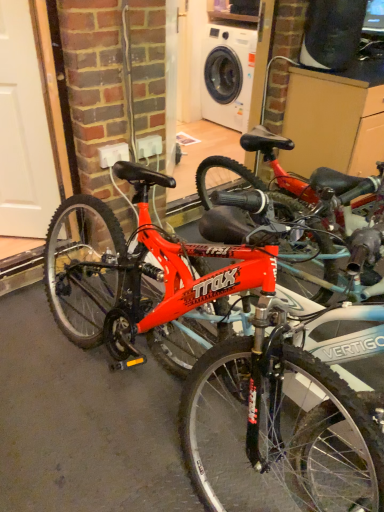
Identify the location of white glossy garage door at left. (24, 130).

From the picture: What is the approximate width of white glossy garage door at left?

2.89 inches.

The image size is (384, 512). Describe the element at coordinates (24, 130) in the screenshot. I see `white glossy garage door at left` at that location.

Locate an element on the screen. This screenshot has width=384, height=512. shiny red bicycle at center is located at coordinates (239, 336).

What do you see at coordinates (239, 336) in the screenshot?
I see `shiny red bicycle at center` at bounding box center [239, 336].

The image size is (384, 512). What are the coordinates of `white glossy garage door at left` in the screenshot? It's located at (24, 130).

Considering the positions of objects white glossy garage door at left and shiny red bicycle at center in the image provided, who is more to the left, white glossy garage door at left or shiny red bicycle at center?

white glossy garage door at left.

Considering their positions, is white glossy garage door at left located in front of or behind shiny red bicycle at center?

white glossy garage door at left is positioned farther from the viewer than shiny red bicycle at center.

Is point (25, 206) less distant than point (335, 184)?

That is False.

From the image's perspective, which object appears higher, white glossy garage door at left or shiny red bicycle at center?

From the image's view, white glossy garage door at left is above.

In the scene shown: From a real-world perspective, is white glossy garage door at left positioned above or below shiny red bicycle at center?

white glossy garage door at left is situated higher than shiny red bicycle at center in the real world.

Does white glossy garage door at left have a lesser width compared to shiny red bicycle at center?

Correct, the width of white glossy garage door at left is less than that of shiny red bicycle at center.

Considering the sizes of objects white glossy garage door at left and shiny red bicycle at center in the image provided, who is shorter, white glossy garage door at left or shiny red bicycle at center?

shiny red bicycle at center is shorter.

Based on their sizes in the image, would you say white glossy garage door at left is bigger or smaller than shiny red bicycle at center?

Considering their sizes, white glossy garage door at left takes up less space than shiny red bicycle at center.

Is shiny red bicycle at center a part of white glossy garage door at left?

No, shiny red bicycle at center is not a part of white glossy garage door at left.

Are white glossy garage door at left and shiny red bicycle at center located far from each other?

No, white glossy garage door at left is in close proximity to shiny red bicycle at center.

Based on the photo, is white glossy garage door at left positioned with its back to shiny red bicycle at center?

No, shiny red bicycle at center is not at the back of white glossy garage door at left.

Find the location of `garage door above the shiny red bicycle at center (from the image's perspective)`. garage door above the shiny red bicycle at center (from the image's perspective) is located at coordinates (24, 130).

Can you confirm if shiny red bicycle at center is positioned to the left of white glossy garage door at left?

No.

Which object is further away from the camera taking this photo, shiny red bicycle at center or white glossy garage door at left?

white glossy garage door at left is behind.

Between point (90, 218) and point (6, 164), which one is positioned in front?

Positioned in front is point (90, 218).

From the image's perspective, is shiny red bicycle at center below white glossy garage door at left?

Indeed, from the image's perspective, shiny red bicycle at center is shown beneath white glossy garage door at left.

From a real-world perspective, is shiny red bicycle at center located beneath white glossy garage door at left?

Indeed, from a real-world perspective, shiny red bicycle at center is positioned beneath white glossy garage door at left.

Considering the sizes of objects shiny red bicycle at center and white glossy garage door at left in the image provided, who is thinner, shiny red bicycle at center or white glossy garage door at left?

Thinner between the two is white glossy garage door at left.

Between shiny red bicycle at center and white glossy garage door at left, which one has more height?

With more height is white glossy garage door at left.

Between shiny red bicycle at center and white glossy garage door at left, which one has smaller size?

white glossy garage door at left.

Is white glossy garage door at left located within shiny red bicycle at center?

That's incorrect, white glossy garage door at left is not inside shiny red bicycle at center.

Is shiny red bicycle at center positioned far away from white glossy garage door at left?

No, shiny red bicycle at center is in close proximity to white glossy garage door at left.

Is white glossy garage door at left at the back of shiny red bicycle at center?

That's not correct — shiny red bicycle at center is not looking away from white glossy garage door at left.

How many degrees apart are the facing directions of shiny red bicycle at center and white glossy garage door at left?

They differ by 87.7 degrees in their facing directions.

How far apart are shiny red bicycle at center and white glossy garage door at left?

The distance of shiny red bicycle at center from white glossy garage door at left is 35.48 inches.

You are a GUI agent. You are given a task and a screenshot of the screen. Output one action in this format:
    pyautogui.click(x=<x>, y=<y>)
    Task: Click on the garage door on the left of shiny red bicycle at center
    Image resolution: width=384 pixels, height=512 pixels.
    Given the screenshot: What is the action you would take?
    pyautogui.click(x=24, y=130)

Locate an element on the screen. This screenshot has width=384, height=512. bicycle in front of the white glossy garage door at left is located at coordinates (239, 336).

This screenshot has width=384, height=512. I want to click on garage door on the left of shiny red bicycle at center, so click(x=24, y=130).